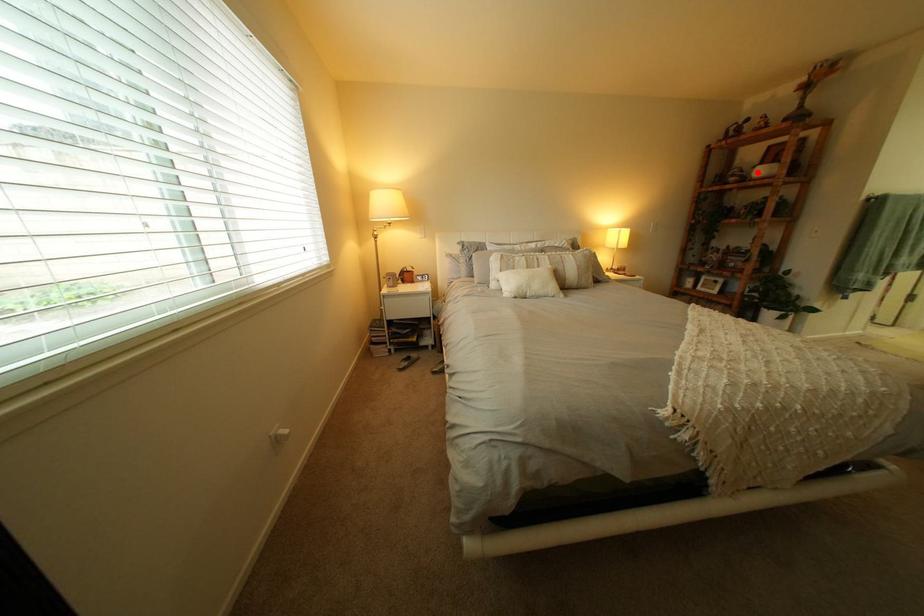
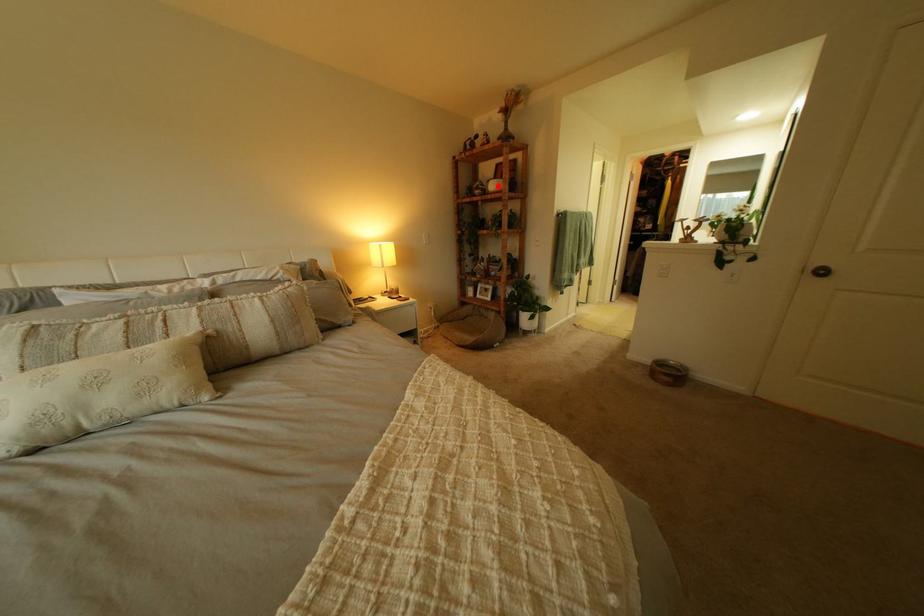
I am providing you with two images of the same scene from different viewpoints. A red point is marked on the first image and another point is marked on the second image. Are the points marked in image1 and image2 representing the same 3D position?

Yes